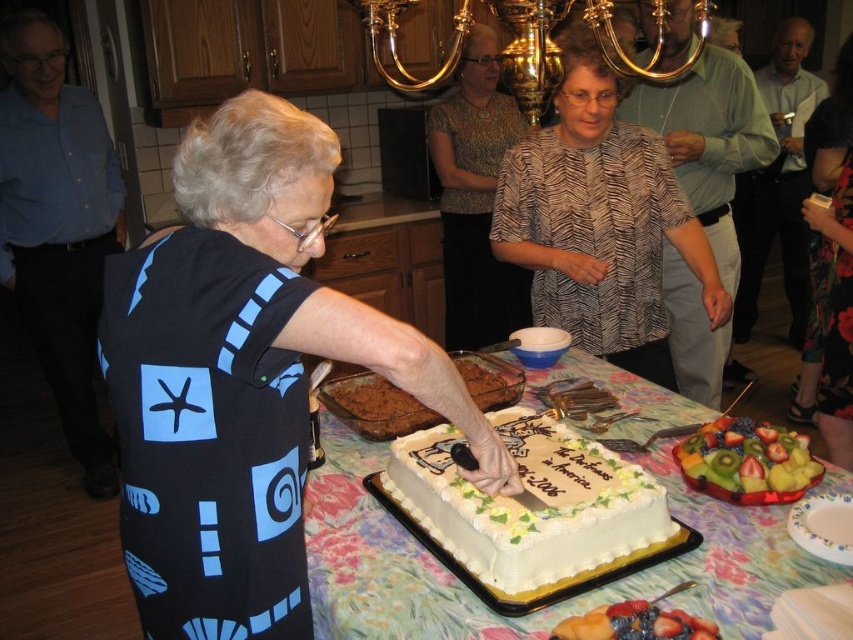
You are standing at point (550, 225) and want to greet someone who is 2.03 meters away. Is the distance within a normal conversational distance?

The distance between you and the person is 2.03 meters, which is within the typical conversational distance range of about 1 to 3 meters, so yes, it is appropriate for conversation.

You are a photographer at the event and want to capture a photo of the printed fabric blouse at center and the white glossy plate at lower right. Which object should be placed closer to the camera to ensure both are in focus?

The printed fabric blouse at center is much taller than the white glossy plate at lower right, so placing the white glossy plate at lower right closer to the camera will help both objects be in focus since it is smaller and needs to be magnified.

You are a photographer standing in the room and want to capture a closeup shot of the blue printed dress at center. The camera you are using has a minimum focusing distance of 75 centimeters. Can you take the photo without moving closer?

The distance of blue printed dress at center from viewer is 77.84 centimeters, which is beyond the camera minimum focusing distance of 75 centimeters. Therefore, you can take the photo without moving closer.